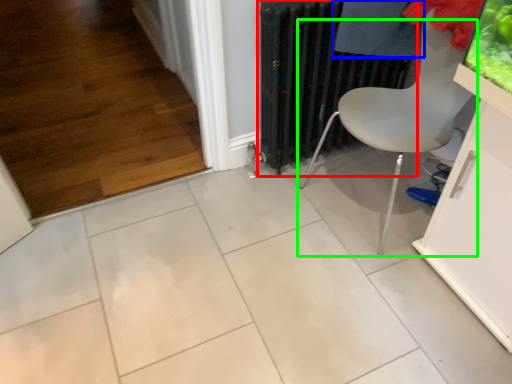
Question: Based on their relative distances, which object is farther from radiator (highlighted by a red box)? Choose from clothing (highlighted by a blue box) and chair (highlighted by a green box).

Choices:
 (A) clothing
 (B) chair

Answer: (B)